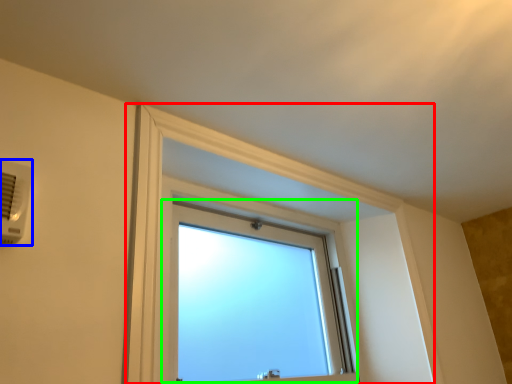
Question: Which object is the farthest from bay window (highlighted by a red box)? Choose among these: air conditioning (highlighted by a blue box) or window (highlighted by a green box).

Choices:
 (A) air conditioning
 (B) window

Answer: (A)